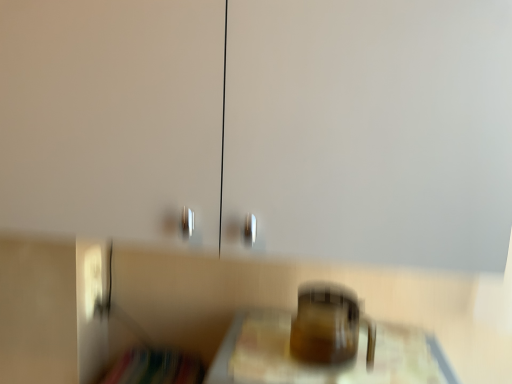
Question: Considering the positions of translucent glass jar at center and translucent glass mug at center in the image, is translucent glass jar at center wider or thinner than translucent glass mug at center?

Choices:
 (A) wide
 (B) thin

Answer: (A)

Question: Visually, is translucent glass jar at center positioned to the left or to the right of translucent glass mug at center?

Choices:
 (A) right
 (B) left

Answer: (A)

Question: Relative to translucent glass mug at center, is translucent glass jar at center in front or behind?

Choices:
 (A) behind
 (B) front

Answer: (B)

Question: In terms of width, does translucent glass mug at center look wider or thinner when compared to translucent glass jar at center?

Choices:
 (A) wide
 (B) thin

Answer: (B)

Question: In the image, is translucent glass mug at center positioned in front of or behind translucent glass jar at center?

Choices:
 (A) behind
 (B) front

Answer: (A)

Question: Considering the positions of translucent glass mug at center and translucent glass jar at center in the image, is translucent glass mug at center taller or shorter than translucent glass jar at center?

Choices:
 (A) tall
 (B) short

Answer: (B)

Question: Considering the positions of translucent glass mug at center and translucent glass jar at center in the image, is translucent glass mug at center bigger or smaller than translucent glass jar at center?

Choices:
 (A) small
 (B) big

Answer: (A)